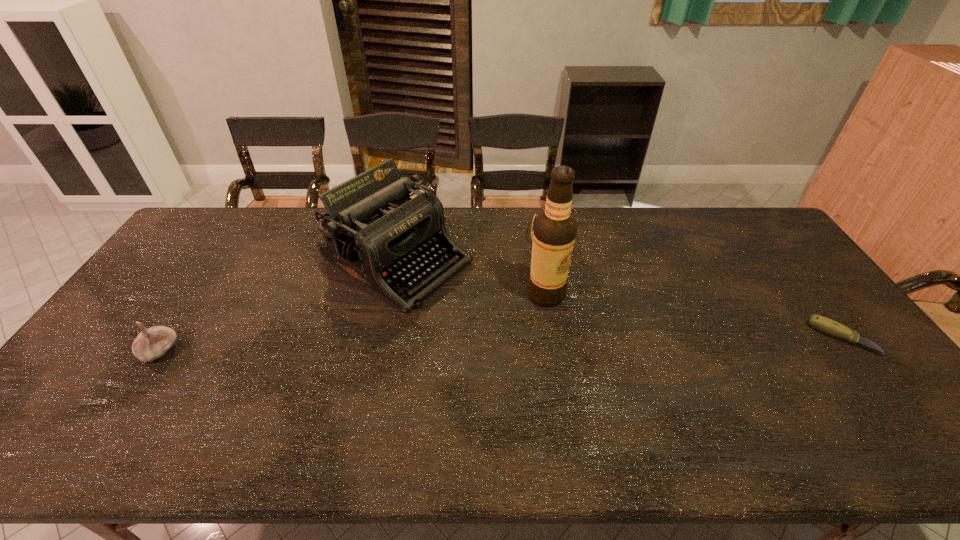
Where is `vacant area between the pocketknife and the leftmost object`? This screenshot has height=540, width=960. vacant area between the pocketknife and the leftmost object is located at coordinates (500, 345).

Locate an element on the screen. This screenshot has height=540, width=960. empty location between the shortest object and the tallest object is located at coordinates (693, 316).

Image resolution: width=960 pixels, height=540 pixels. In order to click on vacant point located between the second tallest object and the pocketknife in this screenshot , I will do [618, 299].

Identify the location of empty space that is in between the leftmost object and the alcohol. This screenshot has height=540, width=960. (353, 322).

This screenshot has width=960, height=540. I want to click on vacant point located between the rightmost object and the sunglasses, so click(x=695, y=285).

Locate an element on the screen. free space between the pocketknife and the tallest object is located at coordinates (693, 316).

Locate an element on the screen. The height and width of the screenshot is (540, 960). vacant space that is in between the alcohol and the third tallest object is located at coordinates (353, 322).

Identify which object is the second closest to the fourth object from right to left. Please provide its 2D coordinates. Your answer should be formatted as a tuple, i.e. [(x, y)], where the tuple contains the x and y coordinates of a point satisfying the conditions above.

[(536, 215)]

Identify which object is the fourth closest to the alcohol. Please provide its 2D coordinates. Your answer should be formatted as a tuple, i.e. [(x, y)], where the tuple contains the x and y coordinates of a point satisfying the conditions above.

[(150, 344)]

Find the location of a particular element. Image resolution: width=960 pixels, height=540 pixels. vacant area that satisfies the following two spatial constraints: 1. on the front side of the pocketknife; 2. on the right side of the fourth shortest object is located at coordinates (380, 338).